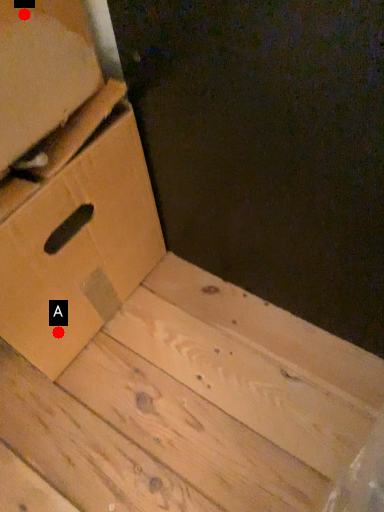
Question: Two points are circled on the image, labeled by A and B beside each circle. Which point appears farthest from the camera in this image?

Choices:
 (A) A is further
 (B) B is further

Answer: (A)